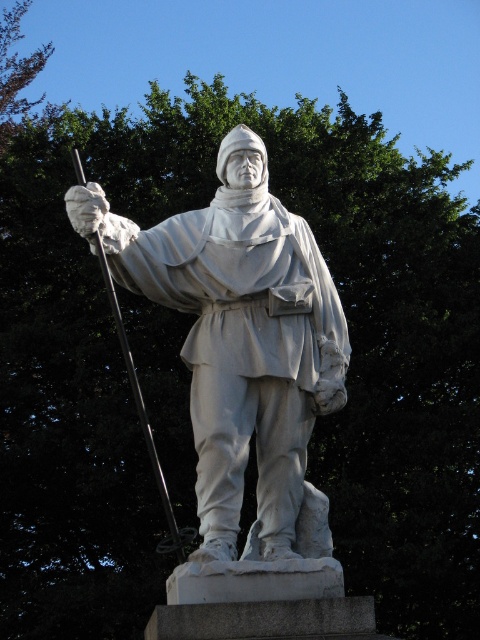
Question: Is white marble statue at center thinner than white marble pole at center?

Choices:
 (A) yes
 (B) no

Answer: (A)

Question: Which of the following is the farthest from the observer?

Choices:
 (A) white marble statue at center
 (B) white marble pole at center

Answer: (B)

Question: Is white marble statue at center behind white marble pole at center?

Choices:
 (A) no
 (B) yes

Answer: (A)

Question: Among these points, which one is farthest from the camera?

Choices:
 (A) (160, 481)
 (B) (216, 500)

Answer: (A)

Question: Which of the following is the closest to the observer?

Choices:
 (A) white marble statue at center
 (B) white marble pole at center

Answer: (A)

Question: Is white marble statue at center thinner than white marble pole at center?

Choices:
 (A) no
 (B) yes

Answer: (B)